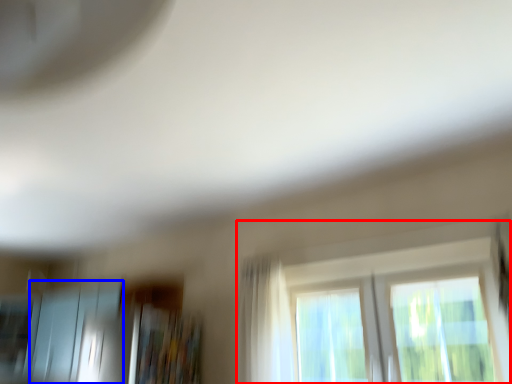
Question: Among these objects, which one is farthest to the camera, window (highlighted by a red box) or screen door (highlighted by a blue box)?

Choices:
 (A) window
 (B) screen door

Answer: (B)